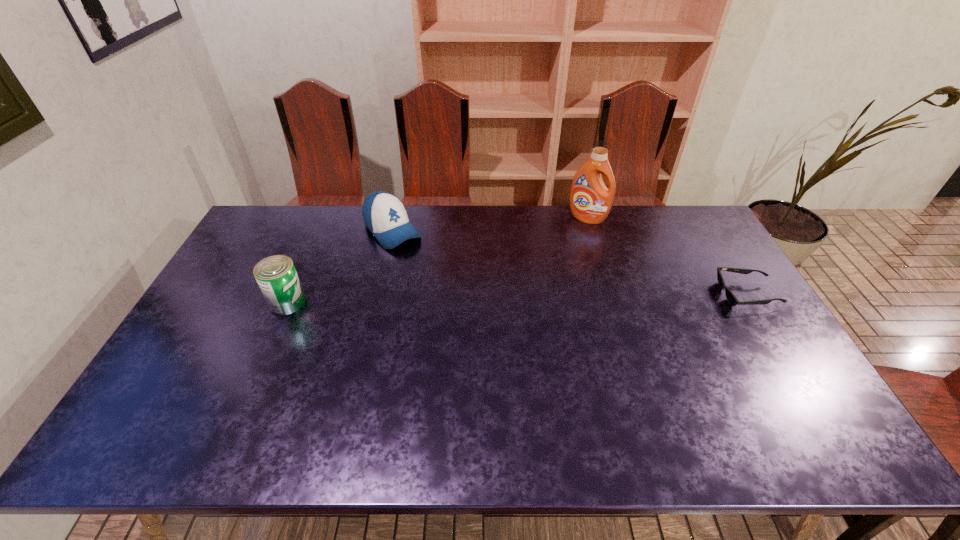
In order to click on blank region between the shortest object and the leftmost object in this screenshot , I will do `click(516, 298)`.

Where is `vacant space in between the detergent and the shortest object`? This screenshot has height=540, width=960. vacant space in between the detergent and the shortest object is located at coordinates (667, 256).

Image resolution: width=960 pixels, height=540 pixels. Identify the location of free space between the leftmost object and the shortest object. (516, 298).

The width and height of the screenshot is (960, 540). What are the coordinates of `free space between the leftmost object and the shortest object` in the screenshot? It's located at (516, 298).

Find the location of a particular element. vacant region between the tallest object and the can is located at coordinates (438, 260).

Identify which object is located as the nearest to the baseball cap. Please provide its 2D coordinates. Your answer should be formatted as a tuple, i.e. [(x, y)], where the tuple contains the x and y coordinates of a point satisfying the conditions above.

[(276, 275)]

Point out which object is positioned as the second nearest to the leftmost object. Please provide its 2D coordinates. Your answer should be formatted as a tuple, i.e. [(x, y)], where the tuple contains the x and y coordinates of a point satisfying the conditions above.

[(590, 200)]

This screenshot has height=540, width=960. What are the coordinates of `free location that satisfies the following two spatial constraints: 1. on the front side of the sunglasses; 2. on the front-facing side of the baseball cap` in the screenshot? It's located at (377, 294).

What are the coordinates of `blank area in the image that satisfies the following two spatial constraints: 1. on the front side of the rightmost object; 2. on the front-facing side of the third object from right to left` in the screenshot? It's located at (377, 294).

You are a GUI agent. You are given a task and a screenshot of the screen. Output one action in this format:
    pyautogui.click(x=<x>, y=<y>)
    Task: Click on the vacant region that satisfies the following two spatial constraints: 1. on the front side of the rightmost object; 2. on the front-facing side of the detergent
    Image resolution: width=960 pixels, height=540 pixels.
    Given the screenshot: What is the action you would take?
    pyautogui.click(x=611, y=294)